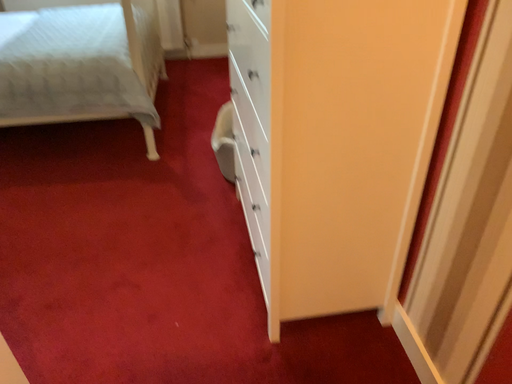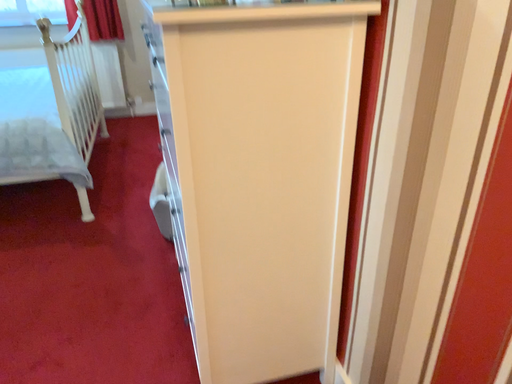
Question: How did the camera likely rotate when shooting the video?

Choices:
 (A) rotated downward
 (B) rotated upward

Answer: (B)